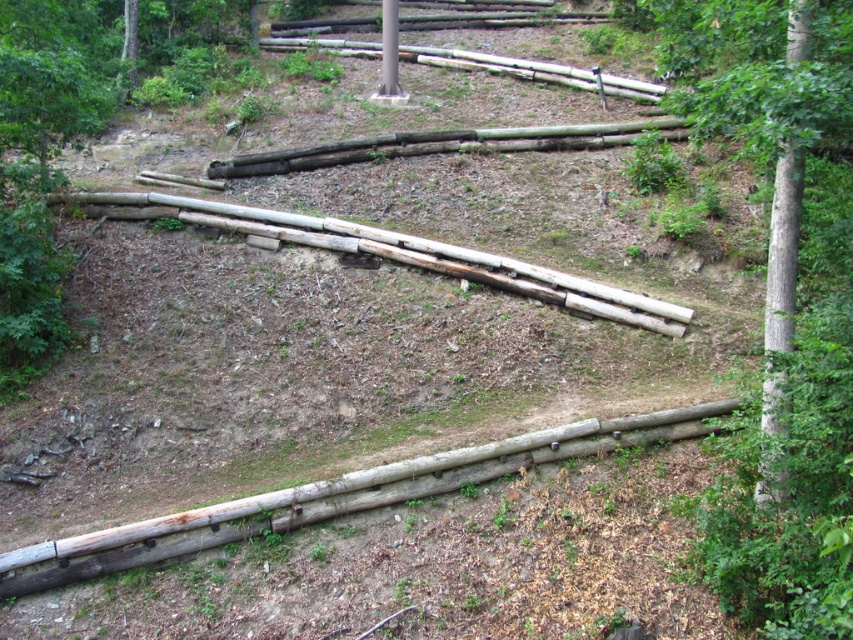
Looking at this image, can you confirm if weathered wood at lower center is positioned below smooth brown tree trunk at right?

Yes.

Looking at this image, can you confirm if weathered wood at lower center is bigger than smooth brown tree trunk at right?

Actually, weathered wood at lower center might be smaller than smooth brown tree trunk at right.

Measure the distance between point (566, 456) and camera.

Point (566, 456) is 35.52 feet from camera.

Locate an element on the screen. Image resolution: width=853 pixels, height=640 pixels. weathered wood at lower center is located at coordinates (334, 499).

Is point (752, 131) in front of point (775, 458)?

Yes, point (752, 131) is in front of point (775, 458).

Is smooth gray bark tree at right shorter than smooth brown tree trunk at right?

Yes.

Does point (849, 396) come behind point (780, 408)?

No.

The image size is (853, 640). What are the coordinates of `smooth gray bark tree at right` in the screenshot? It's located at (775, 172).

Does smooth gray bark tree at right come behind weathered wood at lower center?

That is False.

Between smooth gray bark tree at right and weathered wood at lower center, which one is positioned higher?

smooth gray bark tree at right is higher up.

What do you see at coordinates (775, 172) in the screenshot? I see `smooth gray bark tree at right` at bounding box center [775, 172].

At what (x,y) coordinates should I click in order to perform the action: click on smooth gray bark tree at right. Please return your answer as a coordinate pair (x, y). This screenshot has width=853, height=640. Looking at the image, I should click on (775, 172).